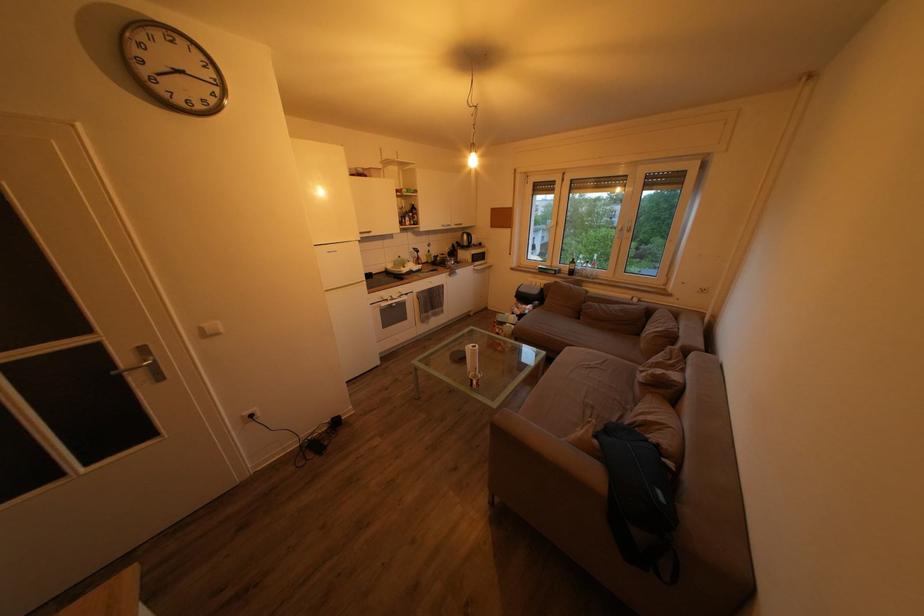
Locate an element on the screen. silver cabinet handle is located at coordinates (173, 485).